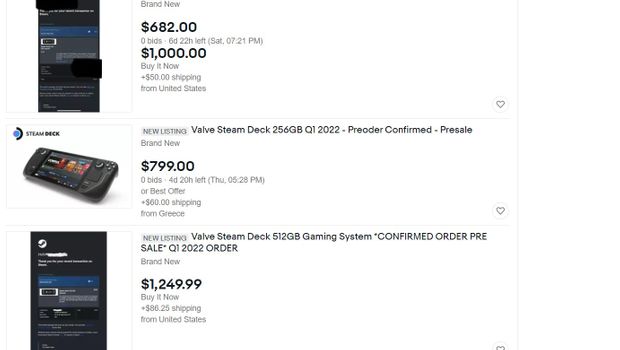
Find the location of a particular element. led is located at coordinates (72, 180).